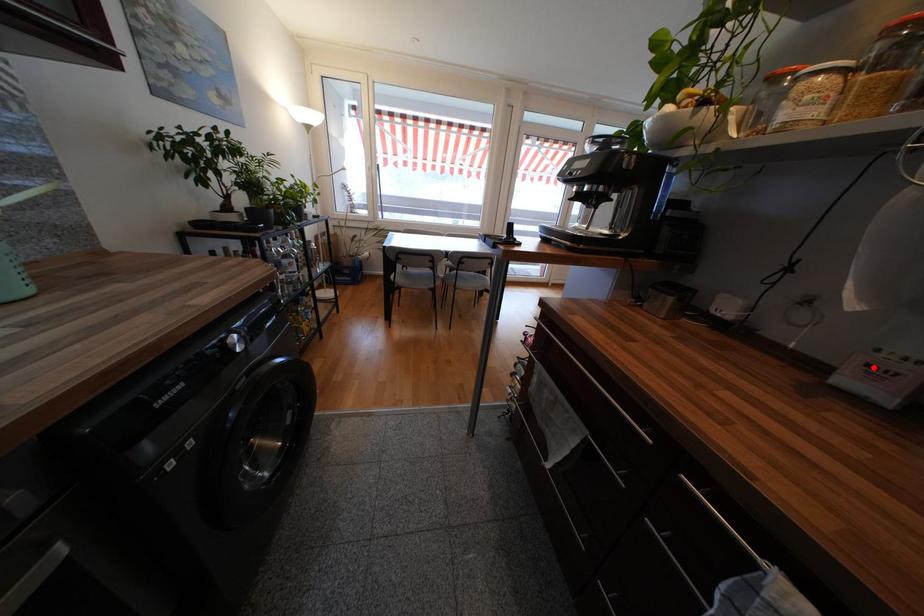
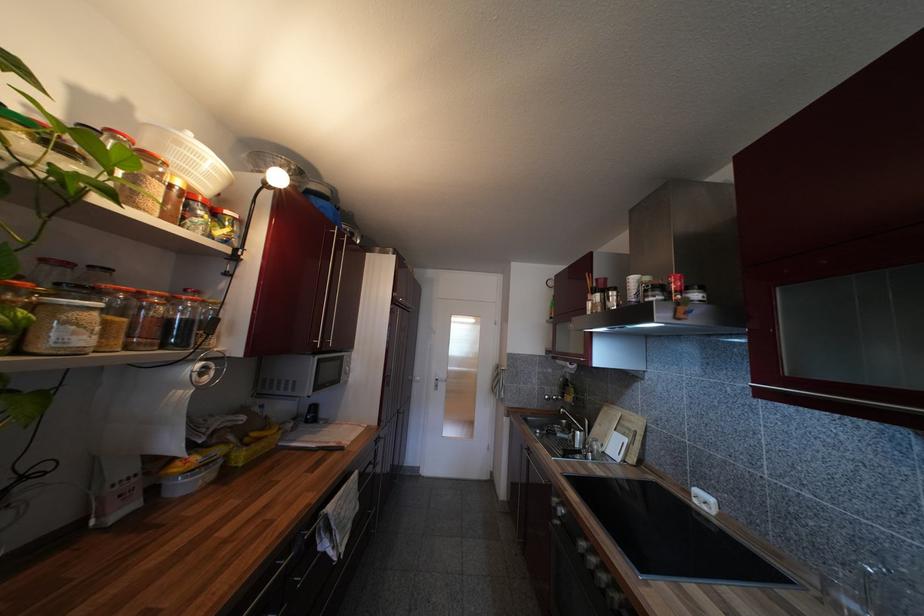
Question: I am providing you with two images of the same scene from different viewpoints. A red point is marked on the first image. Can you still see the location of the red point in image 2?

Choices:
 (A) Yes
 (B) No

Answer: (A)